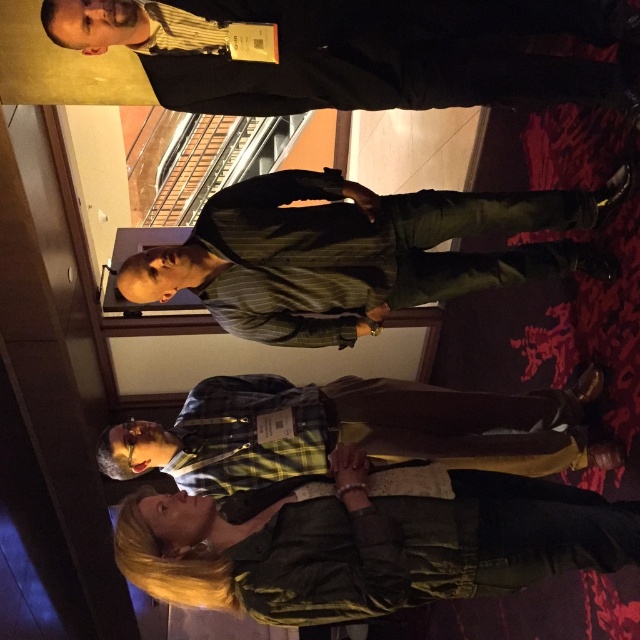
You are organizing a photo shoot and need to ensure that the green textured jacket at lower center and the green striped shirt at center are visible in the frame. Given that the jacket is smaller, which item might require a closer camera focus to capture details?

The green textured jacket at lower center has a smaller size compared to the green striped shirt at center, so the jacket might need closer focus to capture its details.

In the scene shown: You are standing on the second floor of a building and looking down at the scene described. Which of the two shirts, the green striped shirt at center or the yellow plaid shirt at center, is closer to you?

The green striped shirt at center is closer to you because it is located above the yellow plaid shirt at center.